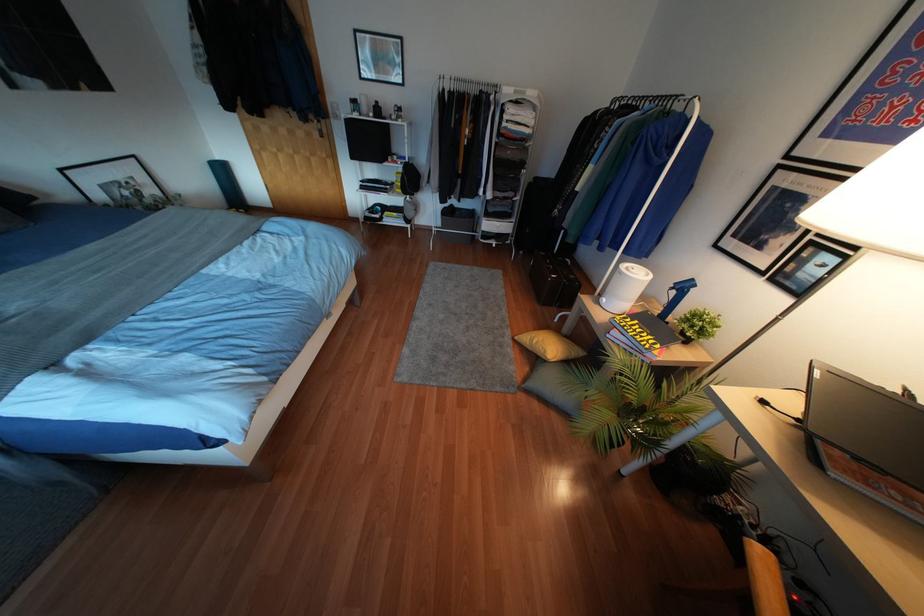
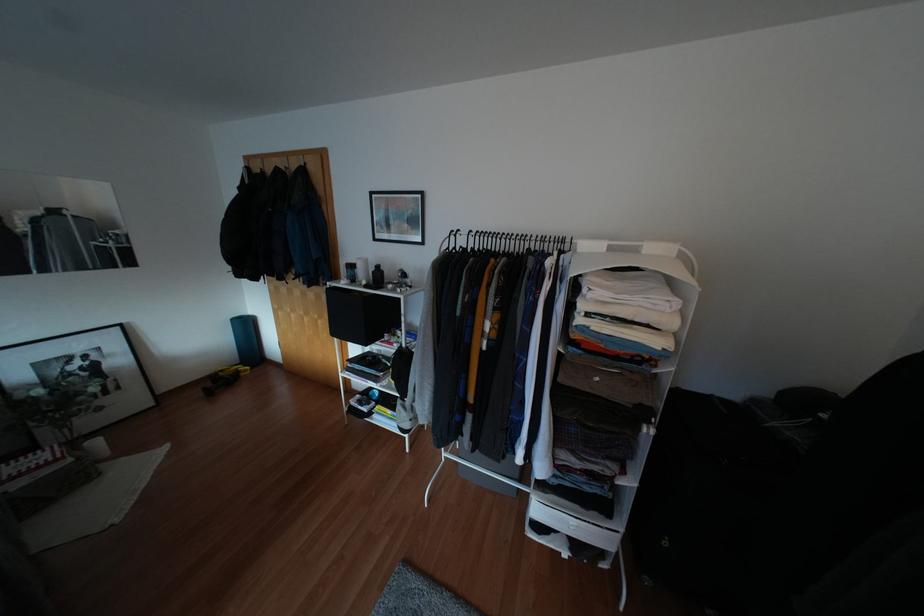
The point at (375, 102) is marked in the first image. Where is the corresponding point in the second image?

(377, 265)